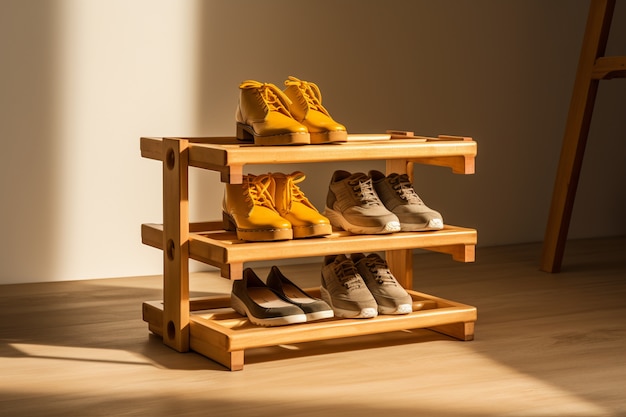
The height and width of the screenshot is (417, 626). I want to click on wood sides of a shoe rack, so click(155, 148), click(151, 231), click(156, 314), click(193, 335), click(213, 253), click(233, 146).